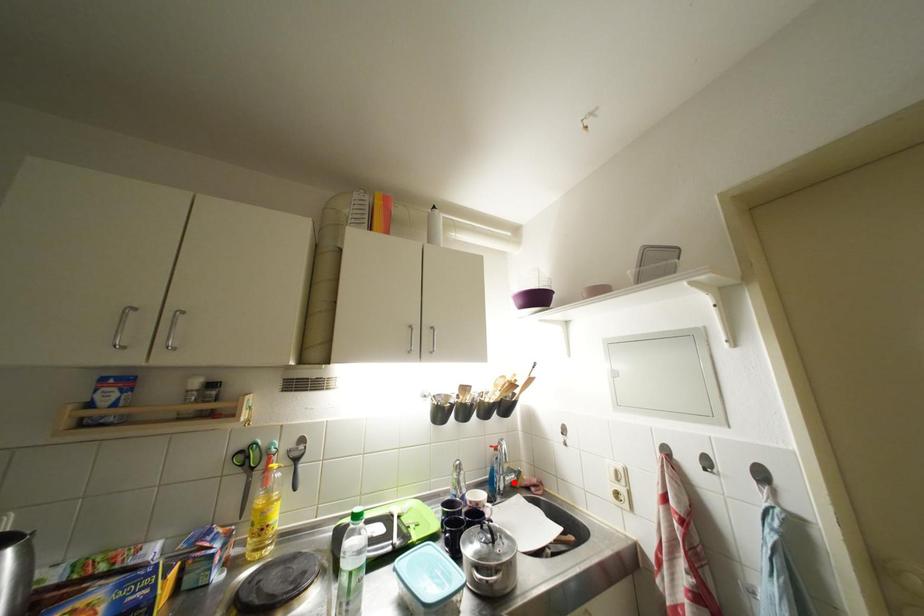
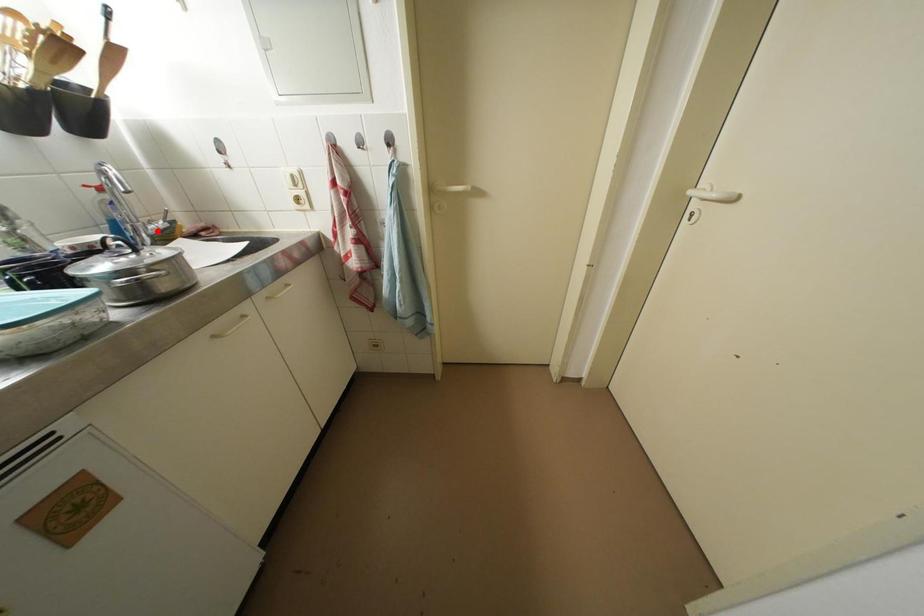
I am providing you with two images of the same scene from different viewpoints. A red point is marked on the first image and another point is marked on the second image. Is the marked point in image1 the same physical position as the marked point in image2?

Yes